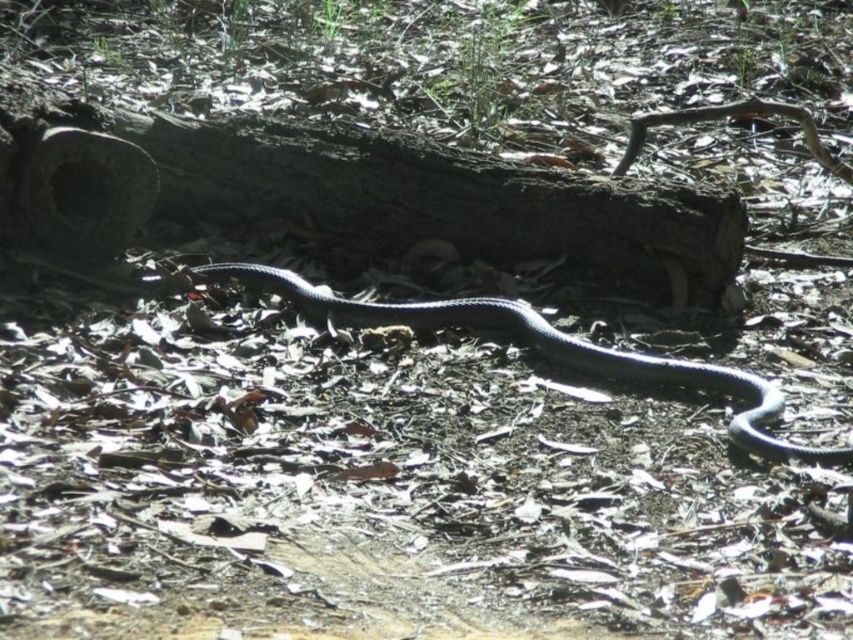
Which is more to the left, dark brown rough log at center or shiny black snake at center?

Positioned to the left is dark brown rough log at center.

Which is below, dark brown rough log at center or shiny black snake at center?

Positioned lower is shiny black snake at center.

Is point (480, 209) farther from viewer compared to point (369, 324)?

Yes, it is behind point (369, 324).

Locate an element on the screen. Image resolution: width=853 pixels, height=640 pixels. dark brown rough log at center is located at coordinates (372, 198).